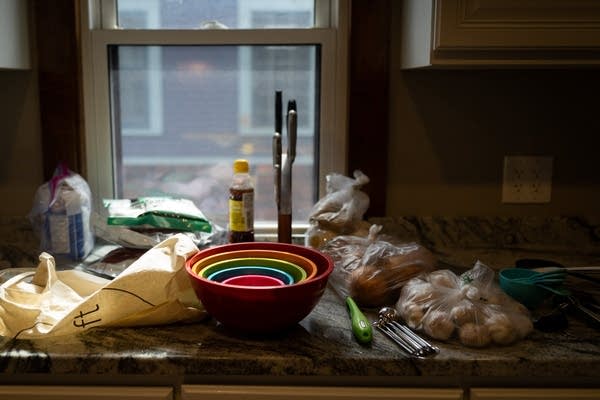
This screenshot has height=400, width=600. I want to click on bottles, so click(x=244, y=209).